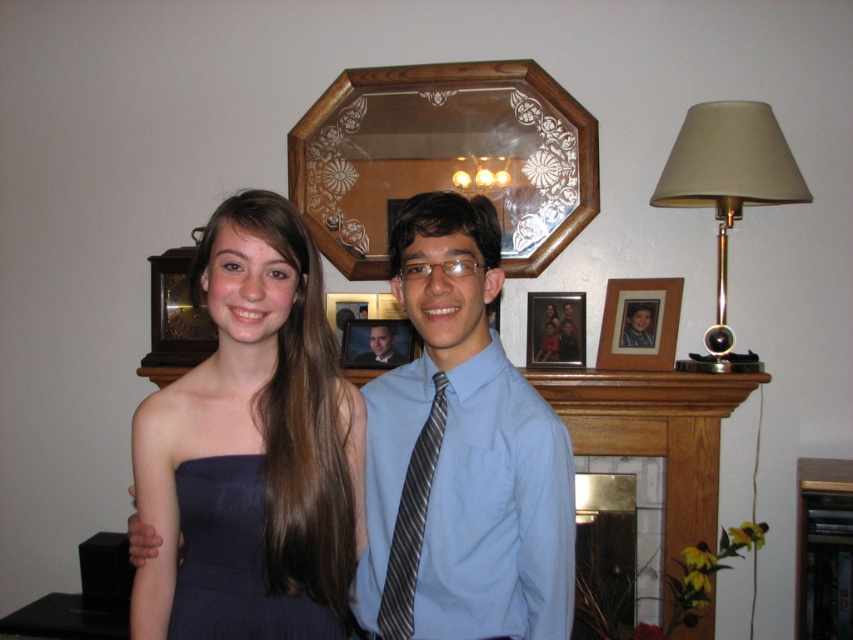
Is wooden framed photo at center to the right of smooth gray suit at center from the viewer's perspective?

Correct, you'll find wooden framed photo at center to the right of smooth gray suit at center.

Between wooden framed photo at center and smooth gray suit at center, which one has less height?

With less height is smooth gray suit at center.

Find the location of a particular element. This screenshot has width=853, height=640. wooden framed photo at center is located at coordinates (555, 330).

In order to click on wooden framed photo at center in this screenshot , I will do (555, 330).

Between blue satin shirt at center and striped fabric tie at center, which one has less height?

striped fabric tie at center is shorter.

Who is more distant from viewer, (450, 346) or (440, 381)?

Point (440, 381)

Between point (434, 497) and point (427, 422), which one is positioned in front?

Point (434, 497) is more forward.

Identify the location of blue satin shirt at center. (461, 454).

Is matte blue dress at center in front of wooden picture frame at upper center?

That is True.

Which of these two, matte blue dress at center or wooden picture frame at upper center, stands shorter?

Standing shorter between the two is wooden picture frame at upper center.

Measure the distance between point [184,586] and camera.

They are 1.29 meters apart.

This screenshot has height=640, width=853. Identify the location of matte blue dress at center. (256, 444).